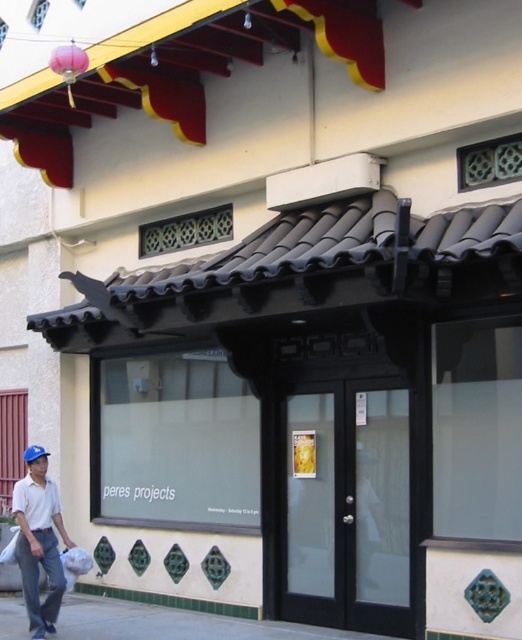
Consider the image. You are standing in front of the building and want to take a photo. There are two points marked on the building wall at coordinates point (341, 637) and point (41, 484). Which point will appear larger in your camera view?

Point (341, 637) is closer to the camera than point (41, 484), so it will appear larger in the camera view.

You are standing on the smooth concrete pavement at lower center and want to place the white matte shirt at lower left on it. Considering their widths, will the shirt fit entirely on the pavement without overhanging?

The smooth concrete pavement at lower center is wider than the white matte shirt at lower left, so the shirt will fit entirely on the pavement without overhanging.